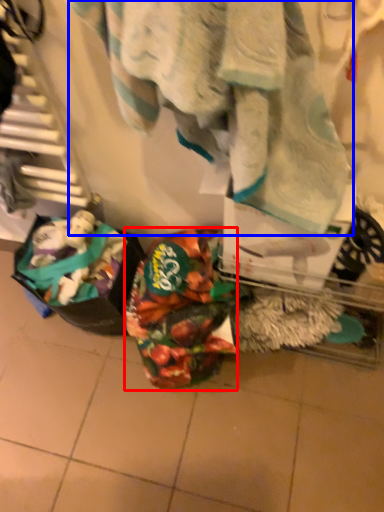
Question: Which object appears closest to the camera in this image, waste (highlighted by a red box) or towel (highlighted by a blue box)?

Choices:
 (A) waste
 (B) towel

Answer: (B)